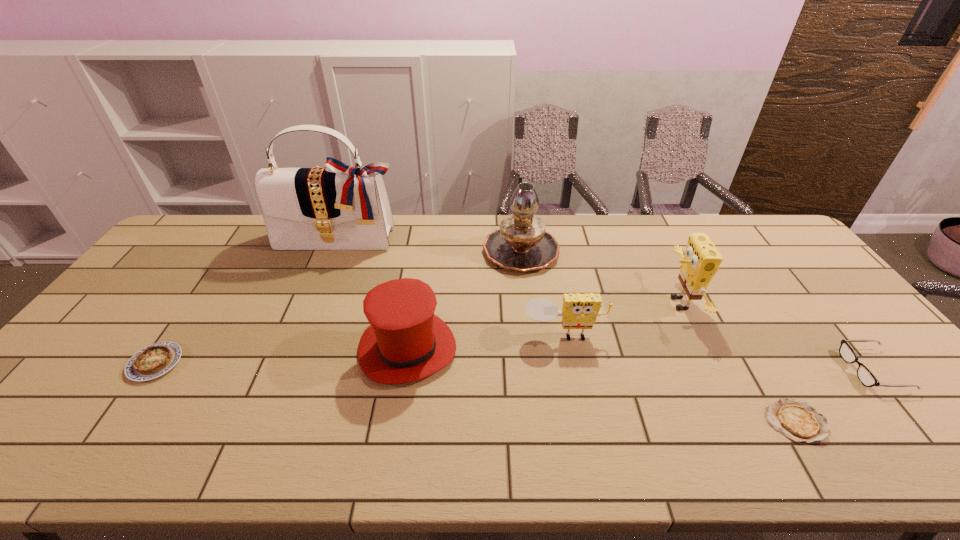
Find the location of a particular element. This screenshot has width=960, height=540. free space located 0.250m on the front-facing side of the rightmost object is located at coordinates (752, 370).

Where is `free spot located 0.090m on the front-facing side of the rightmost object`? This screenshot has height=540, width=960. free spot located 0.090m on the front-facing side of the rightmost object is located at coordinates (815, 370).

What are the coordinates of `vacant space situated 0.370m on the front-facing side of the rightmost object` in the screenshot? It's located at (705, 370).

Where is `vacant region located on the right of the taller quiche`? The height and width of the screenshot is (540, 960). vacant region located on the right of the taller quiche is located at coordinates (254, 363).

You are a GUI agent. You are given a task and a screenshot of the screen. Output one action in this format:
    pyautogui.click(x=<x>, y=<y>)
    Task: Click on the vacant area situated 0.160m on the right of the second object from right to left
    This screenshot has height=540, width=960.
    Given the screenshot: What is the action you would take?
    pyautogui.click(x=893, y=421)

The image size is (960, 540). I want to click on satchel located in the far edge section of the desktop, so click(x=333, y=207).

Image resolution: width=960 pixels, height=540 pixels. Identify the location of oil lamp situated at the far edge. 521,243.

What are the coordinates of `object located at the near edge` in the screenshot? It's located at (795, 419).

Find the location of `object situated at the left edge`. object situated at the left edge is located at coordinates (156, 359).

This screenshot has width=960, height=540. Identify the location of object that is at the right edge. (865, 376).